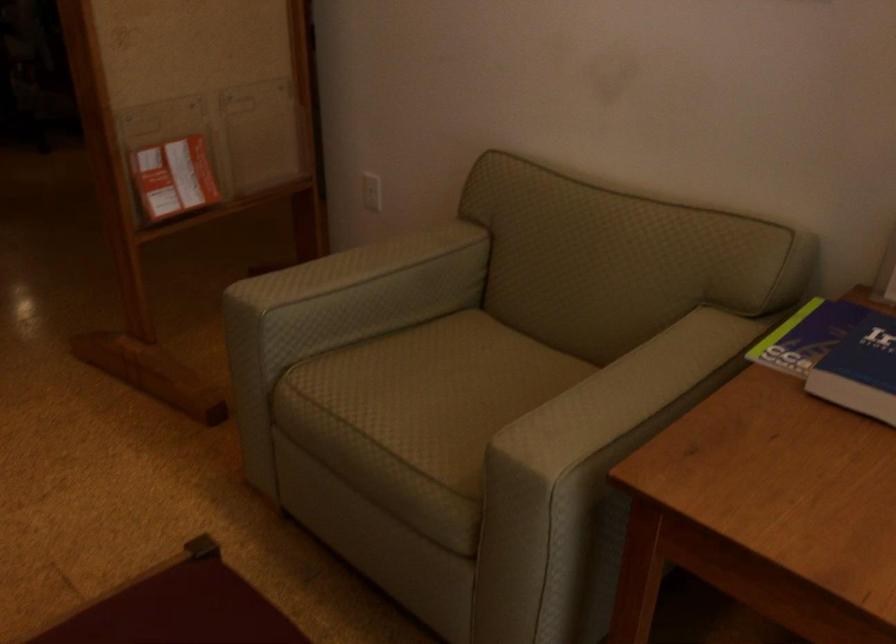
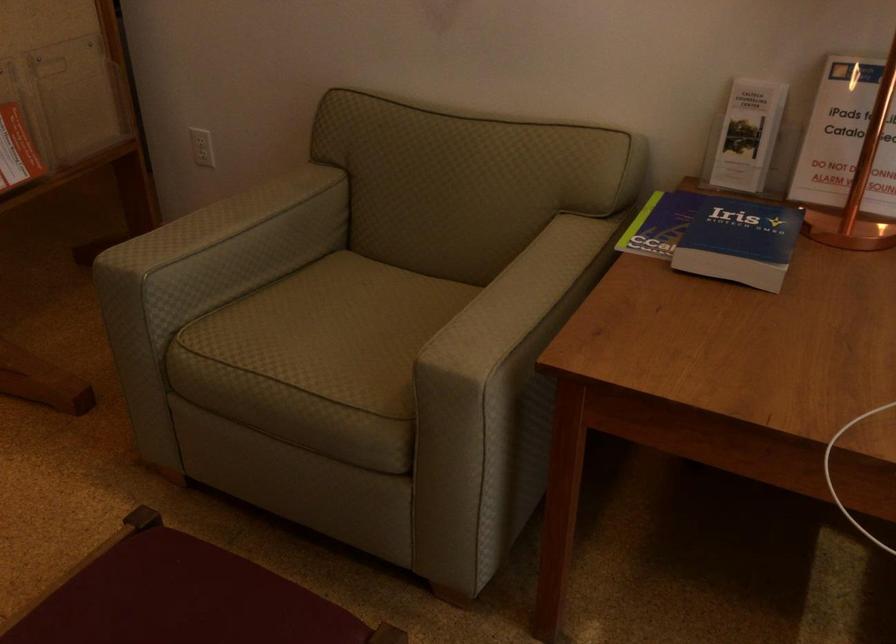
Find the pixel in the second image that matches (444,392) in the first image.

(343, 325)